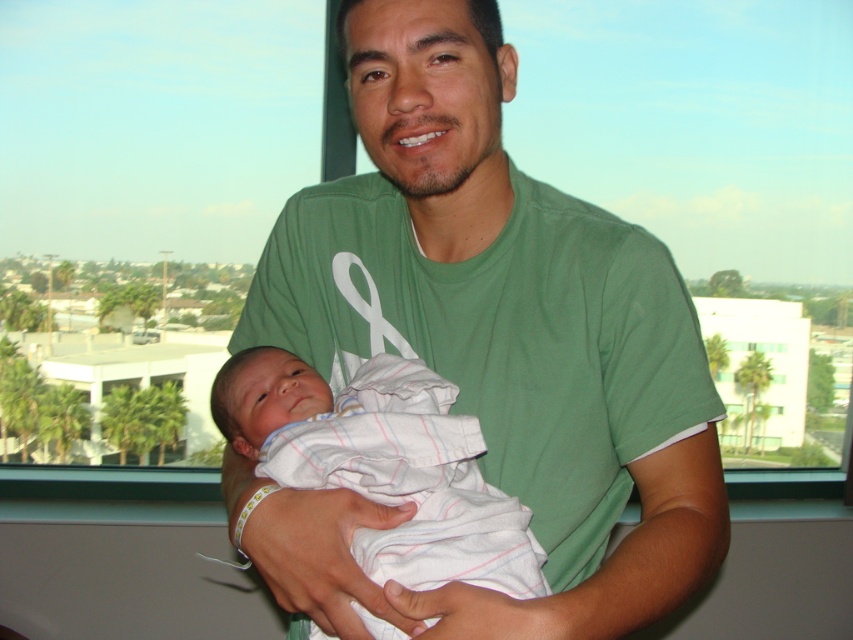
Can you confirm if green cotton shirt at center is taller than white striped cloth at center?

Correct, green cotton shirt at center is much taller as white striped cloth at center.

Measure the distance between green cotton shirt at center and camera.

The distance of green cotton shirt at center from camera is 30.77 inches.

You are a GUI agent. You are given a task and a screenshot of the screen. Output one action in this format:
    pyautogui.click(x=<x>, y=<y>)
    Task: Click on the green cotton shirt at center
    
    Given the screenshot: What is the action you would take?
    pyautogui.click(x=489, y=346)